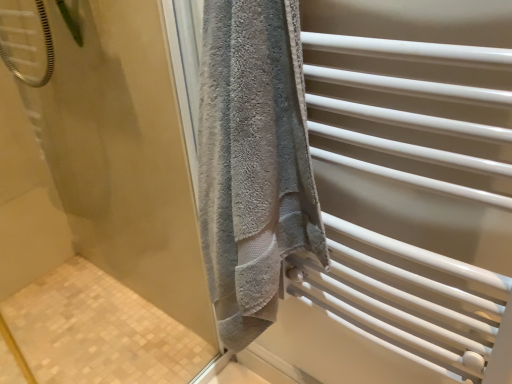
Question: Can we say gray towel at right, which is the 2th screen door in left-to-right order, lies outside gray towel at upper right, the 1th screen door in the left-to-right sequence?

Choices:
 (A) yes
 (B) no

Answer: (A)

Question: Is gray towel at upper right, the 1th screen door in the left-to-right sequence, surrounded by gray towel at right, which is the 2th screen door in left-to-right order?

Choices:
 (A) no
 (B) yes

Answer: (A)

Question: Is gray towel at right, which is the 2th screen door in left-to-right order, oriented towards gray towel at upper right, the 1th screen door in the left-to-right sequence?

Choices:
 (A) no
 (B) yes

Answer: (A)

Question: Is gray towel at right, which is the 2th screen door in left-to-right order, at the right side of gray towel at upper right, placed as the second screen door when sorted from right to left?

Choices:
 (A) yes
 (B) no

Answer: (A)

Question: From the image's perspective, is gray towel at right, the 1th screen door from the right, above gray towel at upper right, placed as the second screen door when sorted from right to left?

Choices:
 (A) no
 (B) yes

Answer: (B)

Question: From the image's perspective, is gray towel at right, which is the 2th screen door in left-to-right order, under gray towel at upper right, placed as the second screen door when sorted from right to left?

Choices:
 (A) yes
 (B) no

Answer: (B)

Question: Is gray towel at upper right, placed as the second screen door when sorted from right to left, with gray towel at right, the 1th screen door from the right?

Choices:
 (A) no
 (B) yes

Answer: (A)

Question: From the image's perspective, would you say gray towel at upper right, the 1th screen door in the left-to-right sequence, is shown under gray towel at right, which is the 2th screen door in left-to-right order?

Choices:
 (A) yes
 (B) no

Answer: (A)

Question: Is gray towel at upper right, placed as the second screen door when sorted from right to left, to the left of gray towel at right, the 1th screen door from the right, from the viewer's perspective?

Choices:
 (A) yes
 (B) no

Answer: (A)

Question: From a real-world perspective, does gray towel at upper right, the 1th screen door in the left-to-right sequence, stand above gray towel at right, the 1th screen door from the right?

Choices:
 (A) yes
 (B) no

Answer: (B)

Question: From the image's perspective, is gray towel at upper right, the 1th screen door in the left-to-right sequence, above gray towel at right, the 1th screen door from the right?

Choices:
 (A) no
 (B) yes

Answer: (A)

Question: Does gray towel at upper right, the 1th screen door in the left-to-right sequence, lie in front of gray towel at right, the 1th screen door from the right?

Choices:
 (A) yes
 (B) no

Answer: (A)

Question: Considering the positions of gray towel at upper right, placed as the second screen door when sorted from right to left, and gray towel at right, the 1th screen door from the right, in the image, is gray towel at upper right, placed as the second screen door when sorted from right to left, bigger or smaller than gray towel at right, the 1th screen door from the right,?

Choices:
 (A) big
 (B) small

Answer: (A)